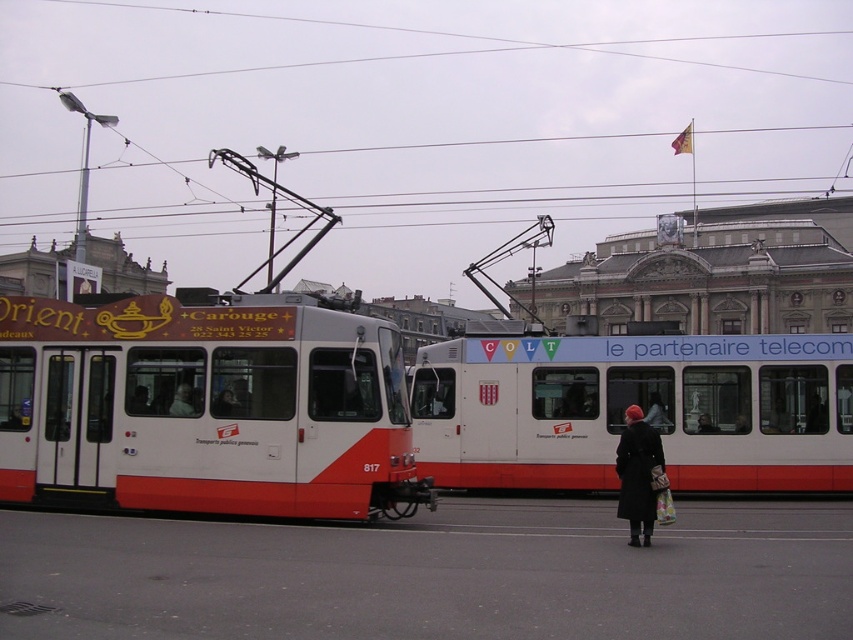
Where is `smooth plastic face at center`? The image size is (853, 640). smooth plastic face at center is located at coordinates (183, 401).

Can you confirm if smooth plastic face at center is smaller than dark brown leather coat at center?

No.

At what (x,y) coordinates should I click in order to perform the action: click on smooth plastic face at center. Please return your answer as a coordinate pair (x, y). This screenshot has width=853, height=640. Looking at the image, I should click on pyautogui.click(x=183, y=401).

Who is higher up, white glossy tram at center or black wool coat at lower right?

white glossy tram at center is above.

Which of these two, white glossy tram at center or black wool coat at lower right, stands shorter?

black wool coat at lower right

Is point (154, 296) in front of point (631, 474)?

That is False.

This screenshot has width=853, height=640. Identify the location of white glossy tram at center. (206, 408).

Does white glossy tram at center have a smaller size compared to dark brown leather coat at center?

Actually, white glossy tram at center might be larger than dark brown leather coat at center.

Between white glossy tram at center and dark brown leather coat at center, which one is positioned higher?

Positioned higher is white glossy tram at center.

Which is behind, point (170, 333) or point (711, 428)?

The point (711, 428) is more distant.

The image size is (853, 640). Find the location of `white glossy tram at center`. white glossy tram at center is located at coordinates (206, 408).